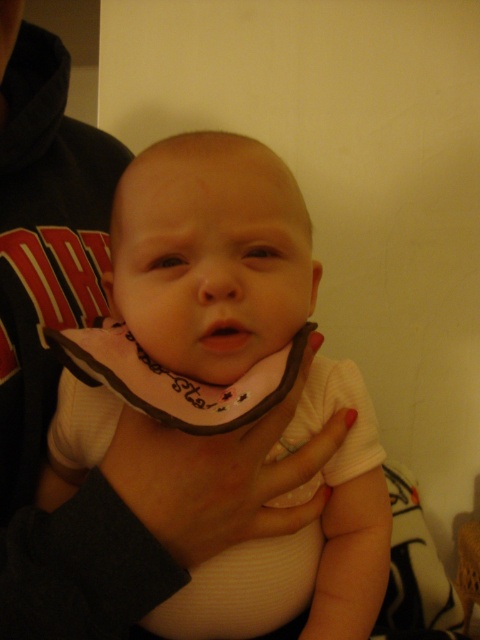
Question: Which object appears farthest from the camera in this image?

Choices:
 (A) white fabric neckband at center
 (B) white ribbed fabric baby at center

Answer: (B)

Question: Does white ribbed fabric baby at center come in front of white fabric neckband at center?

Choices:
 (A) no
 (B) yes

Answer: (A)

Question: Which object appears closest to the camera in this image?

Choices:
 (A) matte pink lips at center
 (B) white fabric neckband at center
 (C) white ribbed fabric baby at center

Answer: (B)

Question: Can you confirm if white fabric neckband at center is wider than matte pink lips at center?

Choices:
 (A) no
 (B) yes

Answer: (B)

Question: Is white fabric neckband at center below matte pink lips at center?

Choices:
 (A) yes
 (B) no

Answer: (A)

Question: Which of the following is the farthest from the observer?

Choices:
 (A) white ribbed fabric baby at center
 (B) matte pink lips at center
 (C) white fabric neckband at center

Answer: (B)